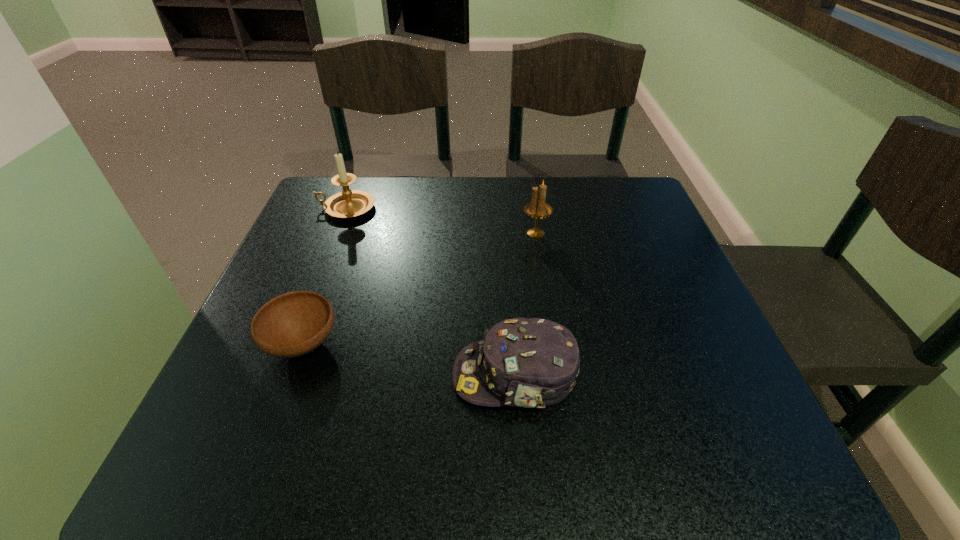
Locate an element on the screen. the farther candle holder is located at coordinates click(x=349, y=203).

Locate an element on the screen. the left candle holder is located at coordinates (349, 203).

The width and height of the screenshot is (960, 540). I want to click on the third nearest object, so click(537, 208).

Find the location of a particular element. the nearer candle holder is located at coordinates (537, 208).

This screenshot has width=960, height=540. Identify the location of the third tallest object. (532, 363).

Identify the location of bowl. The width and height of the screenshot is (960, 540). (293, 324).

You are a GUI agent. You are given a task and a screenshot of the screen. Output one action in this format:
    pyautogui.click(x=<x>, y=<y>)
    Task: Click on the free region located 0.310m on the left of the third nearest object
    The width and height of the screenshot is (960, 540).
    Given the screenshot: What is the action you would take?
    pyautogui.click(x=393, y=233)

What are the coordinates of `vacant space located on the front-facing side of the third tallest object` in the screenshot? It's located at (395, 376).

This screenshot has height=540, width=960. I want to click on vacant region located on the front-facing side of the third tallest object, so click(348, 376).

Locate an element on the screen. vacant region located 0.070m on the front-facing side of the third tallest object is located at coordinates (412, 376).